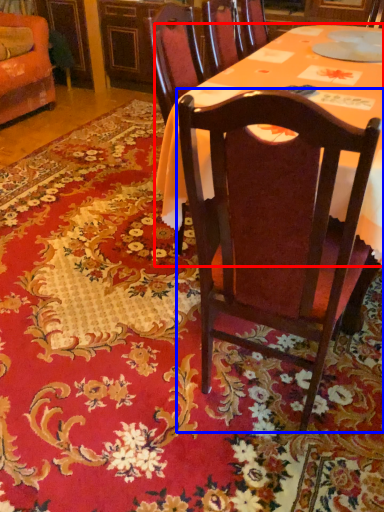
Question: Which point is closer to the camera, desk (highlighted by a red box) or chair (highlighted by a blue box)?

Choices:
 (A) desk
 (B) chair

Answer: (B)